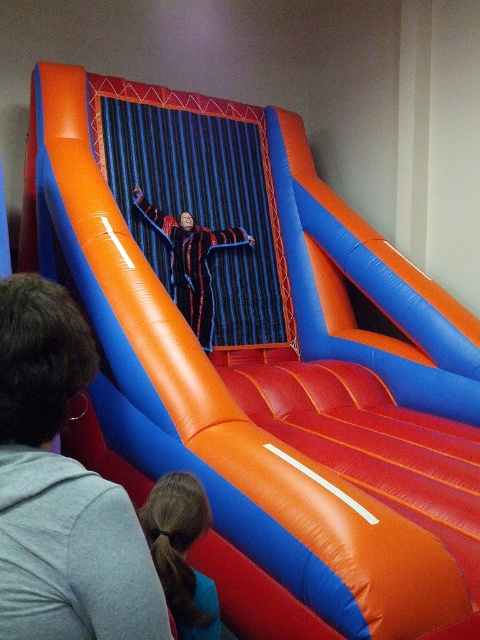
Is smooth brown hair at lower center above black textured jumpsuit at center?

Actually, smooth brown hair at lower center is below black textured jumpsuit at center.

Can you confirm if smooth brown hair at lower center is positioned to the left of black textured jumpsuit at center?

In fact, smooth brown hair at lower center is to the right of black textured jumpsuit at center.

Who is more forward, (178, 561) or (171, 244)?

Point (178, 561) is more forward.

Identify the location of smooth brown hair at lower center. (180, 552).

Which is more to the right, matte black jacket at upper center or smooth brown hair at lower center?

From the viewer's perspective, smooth brown hair at lower center appears more on the right side.

Which is below, matte black jacket at upper center or smooth brown hair at lower center?

Positioned lower is smooth brown hair at lower center.

At what (x,y) coordinates should I click in order to perform the action: click on matte black jacket at upper center. Please return your answer as a coordinate pair (x, y). The image size is (480, 640). Looking at the image, I should click on (60, 490).

Between matte black jacket at upper center and black textured jumpsuit at center, which one is positioned higher?

black textured jumpsuit at center is above.

Can you confirm if matte black jacket at upper center is positioned to the left of black textured jumpsuit at center?

No, matte black jacket at upper center is not to the left of black textured jumpsuit at center.

Which is in front, point (38, 477) or point (190, 257)?

Point (38, 477) is in front.

Where is `matte black jacket at upper center`? matte black jacket at upper center is located at coordinates (60, 490).